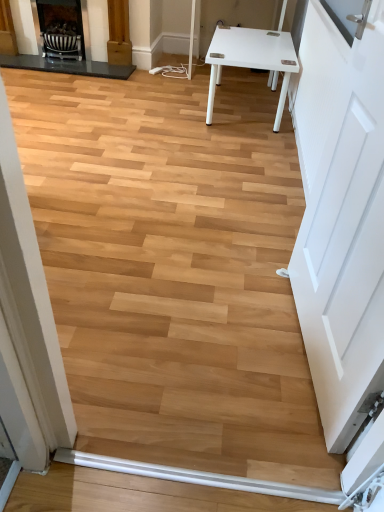
Question: Could you tell me if matte black fireplace at upper left, the 2th fireplace positioned from the right, is facing matte black fireplace at upper left, acting as the 2th fireplace starting from the left?

Choices:
 (A) yes
 (B) no

Answer: (A)

Question: Is matte black fireplace at upper left, acting as the 2th fireplace starting from the left, a part of matte black fireplace at upper left, which is the 1th fireplace in left-to-right order?

Choices:
 (A) no
 (B) yes

Answer: (B)

Question: Is the surface of matte black fireplace at upper left, which is the 1th fireplace in left-to-right order, in direct contact with matte black fireplace at upper left, which is the first fireplace from right to left?

Choices:
 (A) no
 (B) yes

Answer: (B)

Question: Would you say matte black fireplace at upper left, the 2th fireplace positioned from the right, is outside matte black fireplace at upper left, acting as the 2th fireplace starting from the left?

Choices:
 (A) no
 (B) yes

Answer: (B)

Question: Is matte black fireplace at upper left, which is the 1th fireplace in left-to-right order, wider than matte black fireplace at upper left, acting as the 2th fireplace starting from the left?

Choices:
 (A) yes
 (B) no

Answer: (A)

Question: From a real-world perspective, is white smooth baseboard at lower center positioned above or below matte black fireplace at upper left, which is the first fireplace from right to left?

Choices:
 (A) below
 (B) above

Answer: (A)

Question: From the image's perspective, is white smooth baseboard at lower center located above or below matte black fireplace at upper left, acting as the 2th fireplace starting from the left?

Choices:
 (A) below
 (B) above

Answer: (A)

Question: Considering the positions of white smooth baseboard at lower center and matte black fireplace at upper left, acting as the 2th fireplace starting from the left, in the image, is white smooth baseboard at lower center wider or thinner than matte black fireplace at upper left, acting as the 2th fireplace starting from the left,?

Choices:
 (A) wide
 (B) thin

Answer: (B)

Question: Choose the correct answer: Is white smooth baseboard at lower center inside matte black fireplace at upper left, acting as the 2th fireplace starting from the left, or outside it?

Choices:
 (A) inside
 (B) outside

Answer: (B)

Question: Considering the positions of matte black fireplace at upper left, the 2th fireplace positioned from the right, and matte black fireplace at upper left, which is the first fireplace from right to left, in the image, is matte black fireplace at upper left, the 2th fireplace positioned from the right, wider or thinner than matte black fireplace at upper left, which is the first fireplace from right to left,?

Choices:
 (A) wide
 (B) thin

Answer: (A)

Question: Considering their positions, is matte black fireplace at upper left, which is the 1th fireplace in left-to-right order, located in front of or behind matte black fireplace at upper left, which is the first fireplace from right to left?

Choices:
 (A) behind
 (B) front

Answer: (B)

Question: From their relative heights in the image, would you say matte black fireplace at upper left, which is the 1th fireplace in left-to-right order, is taller or shorter than matte black fireplace at upper left, which is the first fireplace from right to left?

Choices:
 (A) short
 (B) tall

Answer: (B)

Question: Is matte black fireplace at upper left, the 2th fireplace positioned from the right, spatially inside matte black fireplace at upper left, acting as the 2th fireplace starting from the left, or outside of it?

Choices:
 (A) outside
 (B) inside

Answer: (A)

Question: From the image's perspective, is matte black fireplace at upper left, which is the 1th fireplace in left-to-right order, positioned above or below white smooth baseboard at lower center?

Choices:
 (A) above
 (B) below

Answer: (A)

Question: Is point (3, 53) closer or farther from the camera than point (185, 472)?

Choices:
 (A) farther
 (B) closer

Answer: (A)